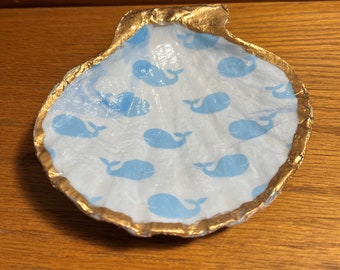
Locate an element on the screen. This screenshot has width=340, height=270. gold border is located at coordinates (117, 40), (251, 46), (194, 232).